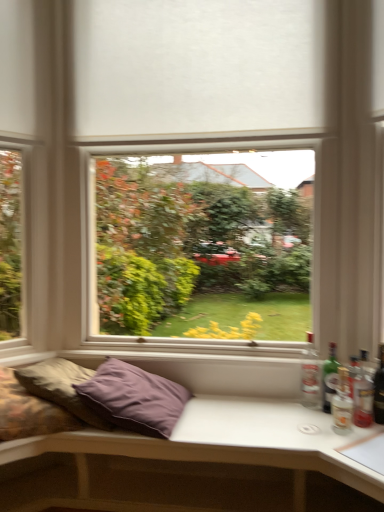
Question: Is translucent glass bottle at right, which ranks as the first bottle in front-to-back order, not near green glass bottle at right, the second bottle from the left?

Choices:
 (A) yes
 (B) no

Answer: (B)

Question: From the image's perspective, is translucent glass bottle at right, which ranks as the first bottle in front-to-back order, over green glass bottle at right, placed as the 2th bottle when sorted from front to back?

Choices:
 (A) no
 (B) yes

Answer: (A)

Question: Is translucent glass bottle at right, the first bottle viewed from the right, further to camera compared to green glass bottle at right, arranged as the 2th bottle when viewed from the right?

Choices:
 (A) yes
 (B) no

Answer: (B)

Question: Considering the relative sizes of translucent glass bottle at right, the first bottle viewed from the right, and green glass bottle at right, placed as the 2th bottle when sorted from front to back, in the image provided, is translucent glass bottle at right, the first bottle viewed from the right, wider than green glass bottle at right, placed as the 2th bottle when sorted from front to back,?

Choices:
 (A) no
 (B) yes

Answer: (B)

Question: Considering the relative sizes of translucent glass bottle at right, the first bottle viewed from the right, and green glass bottle at right, placed as the 2th bottle when sorted from front to back, in the image provided, is translucent glass bottle at right, the first bottle viewed from the right, taller than green glass bottle at right, placed as the 2th bottle when sorted from front to back,?

Choices:
 (A) yes
 (B) no

Answer: (A)

Question: Does translucent glass bottle at right, the first bottle viewed from the right, have a lesser width compared to green glass bottle at right, the second bottle in the back-to-front sequence?

Choices:
 (A) no
 (B) yes

Answer: (A)

Question: Is translucent glass beer bottle at right far from purple fabric pillow at lower left, which is the 1th pillow from left to right?

Choices:
 (A) no
 (B) yes

Answer: (B)

Question: Can you confirm if translucent glass beer bottle at right is thinner than purple fabric pillow at lower left, the 2th pillow from the right?

Choices:
 (A) yes
 (B) no

Answer: (A)

Question: Is purple fabric pillow at lower left, which is the 1th pillow from left to right, at the back of translucent glass beer bottle at right?

Choices:
 (A) yes
 (B) no

Answer: (B)

Question: Is translucent glass beer bottle at right in front of purple fabric pillow at lower left, the 2th pillow from the right?

Choices:
 (A) no
 (B) yes

Answer: (A)

Question: Could you tell me if translucent glass beer bottle at right is facing purple fabric pillow at lower left, the 2th pillow from the right?

Choices:
 (A) yes
 (B) no

Answer: (B)

Question: Does translucent glass beer bottle at right contain purple fabric pillow at lower left, which is the 1th pillow from left to right?

Choices:
 (A) yes
 (B) no

Answer: (B)

Question: From the image's perspective, is green glass bottle at right, arranged as the 2th bottle when viewed from the right, located above clear glass bottle at right, which is the first bottle from back to front?

Choices:
 (A) yes
 (B) no

Answer: (B)